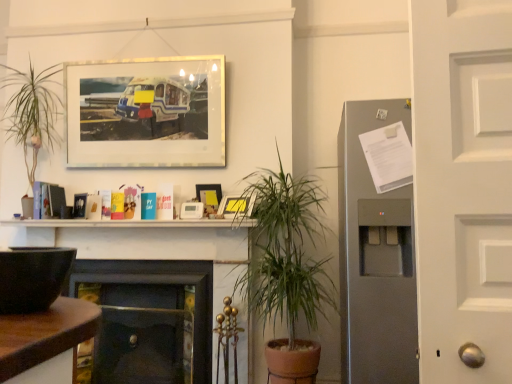
Question: Does matte black bowl at left appear on the left side of dark wood fireplace at center, which ranks as the first fireplace in left-to-right order?

Choices:
 (A) yes
 (B) no

Answer: (B)

Question: Is matte black bowl at left next to dark wood fireplace at center, which ranks as the third fireplace in right-to-left order, and touching it?

Choices:
 (A) no
 (B) yes

Answer: (A)

Question: Is matte black bowl at left far away from dark wood fireplace at center, which ranks as the third fireplace in right-to-left order?

Choices:
 (A) no
 (B) yes

Answer: (B)

Question: Is matte black bowl at left to the right of dark wood fireplace at center, which ranks as the third fireplace in right-to-left order, from the viewer's perspective?

Choices:
 (A) no
 (B) yes

Answer: (B)

Question: From a real-world perspective, is matte black bowl at left below dark wood fireplace at center, which ranks as the third fireplace in right-to-left order?

Choices:
 (A) no
 (B) yes

Answer: (A)

Question: Considering the relative positions of matte black bowl at left and matte glass picture frame at upper center, the first picture frame viewed from the left, in the image provided, is matte black bowl at left to the left or to the right of matte glass picture frame at upper center, the first picture frame viewed from the left,?

Choices:
 (A) left
 (B) right

Answer: (B)

Question: In terms of width, does matte black bowl at left look wider or thinner when compared to matte glass picture frame at upper center, the first picture frame in the top-to-bottom sequence?

Choices:
 (A) thin
 (B) wide

Answer: (B)

Question: From the image's perspective, is matte black bowl at left located above or below matte glass picture frame at upper center, the 3th picture frame in the bottom-to-top sequence?

Choices:
 (A) above
 (B) below

Answer: (B)

Question: Is matte black bowl at left taller or shorter than matte glass picture frame at upper center, the first picture frame in the top-to-bottom sequence?

Choices:
 (A) tall
 (B) short

Answer: (B)

Question: Choose the correct answer: Is green leafy plant at center inside matte glass picture frame at upper center, the 3th picture frame in the bottom-to-top sequence, or outside it?

Choices:
 (A) inside
 (B) outside

Answer: (B)

Question: Is point (278, 254) closer or farther from the camera than point (202, 56)?

Choices:
 (A) closer
 (B) farther

Answer: (A)

Question: Would you say green leafy plant at center is to the left or to the right of matte glass picture frame at upper center, the first picture frame viewed from the left, in the picture?

Choices:
 (A) right
 (B) left

Answer: (A)

Question: From a real-world perspective, is green leafy plant at center positioned above or below matte glass picture frame at upper center, the 3th picture frame in the bottom-to-top sequence?

Choices:
 (A) below
 (B) above

Answer: (A)

Question: Based on their positions, is matte glass picture frame at upper center, the 3th picture frame in the bottom-to-top sequence, located to the left or right of matte wooden picture frame at center, the second picture frame in the top-to-bottom sequence?

Choices:
 (A) right
 (B) left

Answer: (B)

Question: Is matte glass picture frame at upper center, which ranks as the 3th picture frame in right-to-left order, wider or thinner than matte wooden picture frame at center, placed as the 2th picture frame when sorted from left to right?

Choices:
 (A) wide
 (B) thin

Answer: (A)